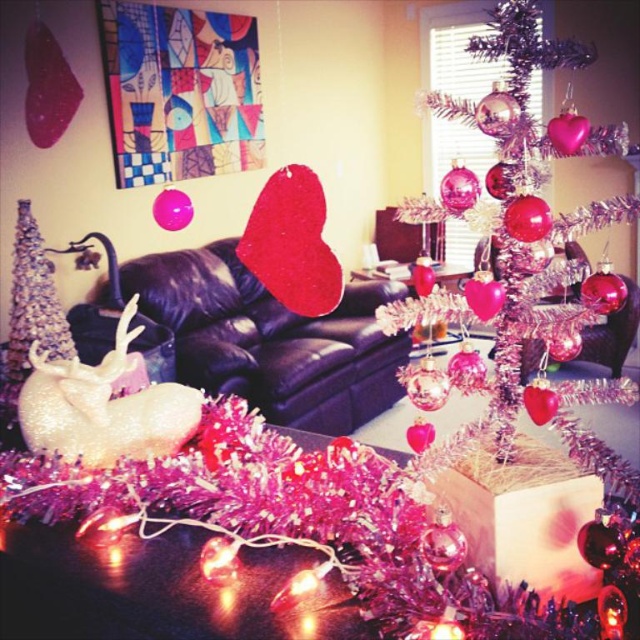
You are planning to place a large gift box under the shiny silver christmas tree at center and the shiny silver christmas tree at left. Which tree will require a larger space for the gift box?

The shiny silver christmas tree at center requires a larger space for the gift box because it has a larger size compared to the shiny silver christmas tree at left.

You are standing in the room and see the shiny silver christmas tree at center and the shiny silver christmas tree at left. Which one is closer to you?

The shiny silver christmas tree at center is closer to you because it is in front of the shiny silver christmas tree at left.